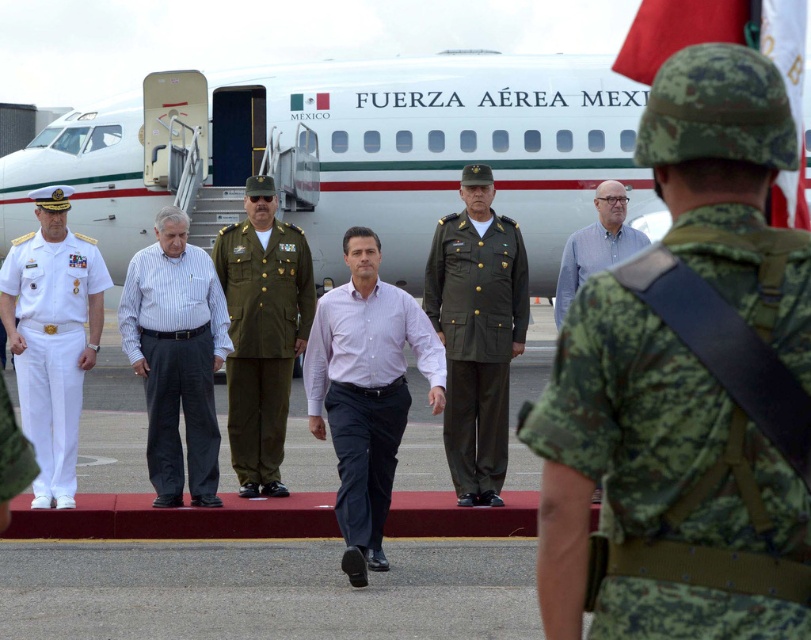
Between camo fabric uniform at center and olive green fabric uniform at center, which one is positioned higher?

Positioned higher is camo fabric uniform at center.

What do you see at coordinates (624, 410) in the screenshot?
I see `camo fabric uniform at center` at bounding box center [624, 410].

Identify the location of camo fabric uniform at center. Image resolution: width=811 pixels, height=640 pixels. (624, 410).

Does camo fabric uniform at center appear under white striped shirt at center?

Actually, camo fabric uniform at center is above white striped shirt at center.

Does camo fabric uniform at center lie behind white striped shirt at center?

No.

Does point (589, 481) lie behind point (204, 499)?

No.

Where is `camo fabric uniform at center`? The height and width of the screenshot is (640, 811). camo fabric uniform at center is located at coordinates point(624,410).

Can you confirm if olive green fabric uniform at center is positioned above light blue shirt at center?

Incorrect, olive green fabric uniform at center is not positioned above light blue shirt at center.

Where is `olive green fabric uniform at center`? This screenshot has width=811, height=640. olive green fabric uniform at center is located at coordinates (262, 340).